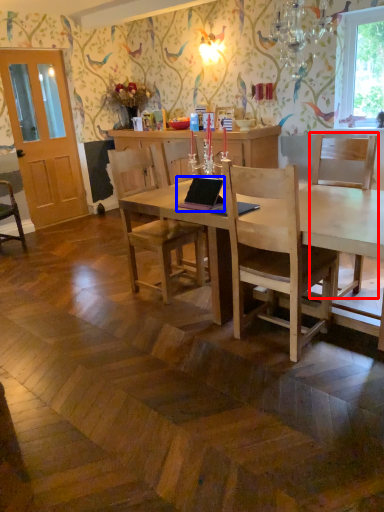
Question: Which object is closer to the camera taking this photo, chair (highlighted by a red box) or laptop (highlighted by a blue box)?

Choices:
 (A) chair
 (B) laptop

Answer: (A)